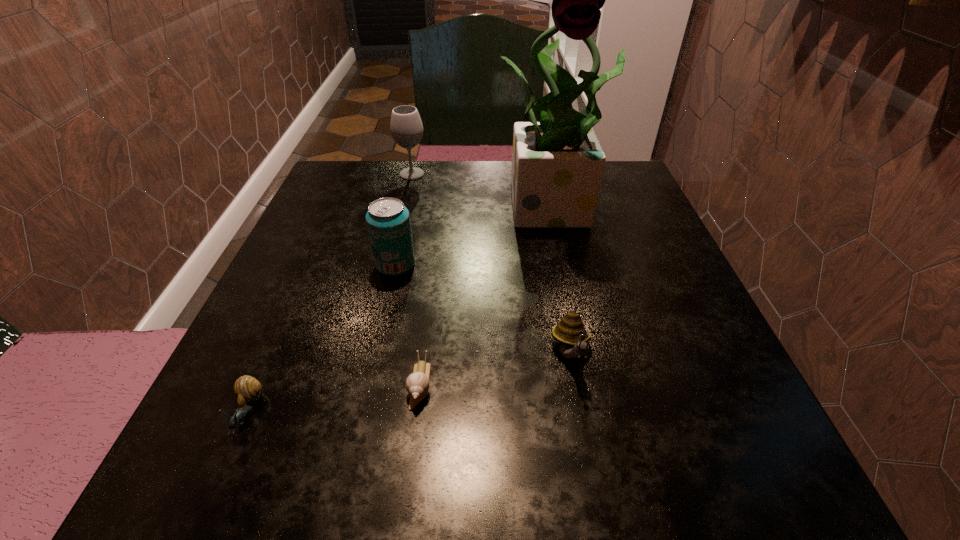
Identify the location of empty location between the flower arrangement and the second shortest object. (402, 308).

I want to click on free spot between the third farthest object and the tallest object, so click(476, 235).

The image size is (960, 540). In order to click on empty space between the second shortest object and the beer can in this screenshot , I will do `click(322, 339)`.

What are the coordinates of `vacant region between the leftmost object and the shortest object` in the screenshot? It's located at [x=334, y=398].

At what (x,y) coordinates should I click in order to perform the action: click on unoccupied area between the flower arrangement and the leftmost object. Please return your answer as a coordinate pair (x, y). The image size is (960, 540). Looking at the image, I should click on (402, 308).

Where is `object that is the fifth closest one to the leftmost object`? The height and width of the screenshot is (540, 960). object that is the fifth closest one to the leftmost object is located at coordinates (406, 128).

Locate an element on the screen. This screenshot has height=540, width=960. object that is the second closest one to the leftmost object is located at coordinates (388, 221).

Image resolution: width=960 pixels, height=540 pixels. Find the location of `escargot that stands as the second closest to the second tallest object`. escargot that stands as the second closest to the second tallest object is located at coordinates (417, 384).

Locate which escargot is the closest to the second escargot from left to right. Please provide its 2D coordinates. Your answer should be formatted as a tuple, i.e. [(x, y)], where the tuple contains the x and y coordinates of a point satisfying the conditions above.

[(570, 332)]